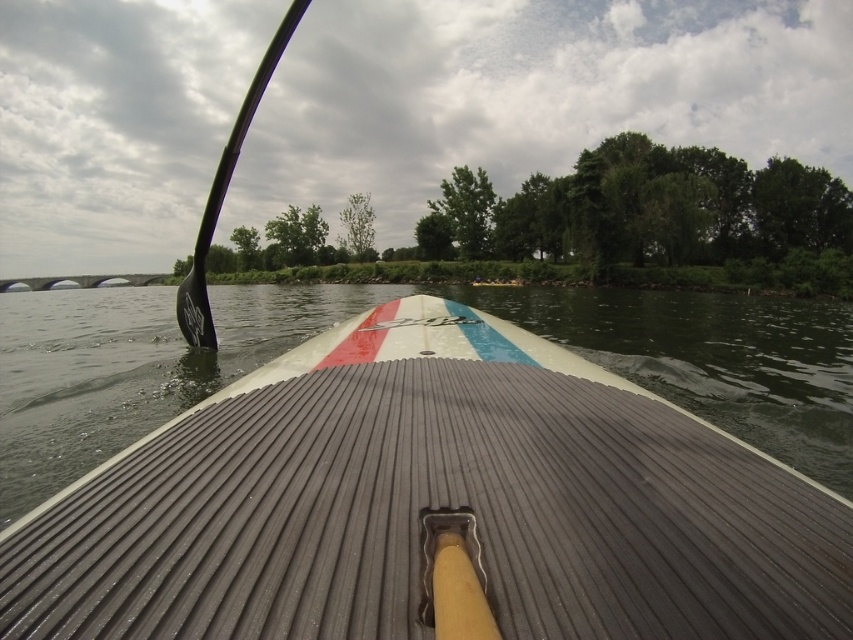
Can you confirm if smooth gray paddleboard at center is shorter than black rubber paddle at left?

Indeed, smooth gray paddleboard at center has a lesser height compared to black rubber paddle at left.

Describe the element at coordinates (431, 506) in the screenshot. I see `smooth gray paddleboard at center` at that location.

Locate an element on the screen. This screenshot has height=640, width=853. smooth gray paddleboard at center is located at coordinates (431, 506).